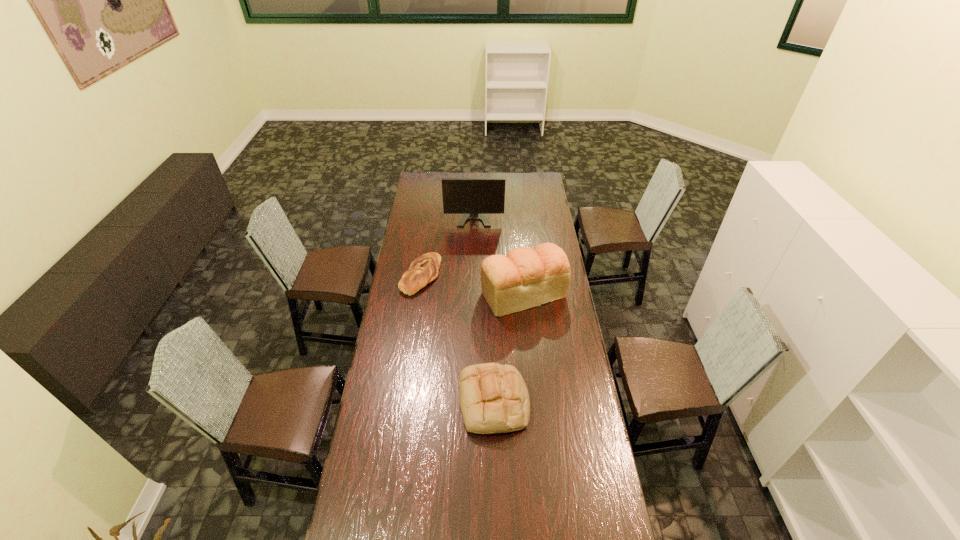
Locate an element on the screen. The image size is (960, 540). vacant space in between the third shortest object and the tallest bread is located at coordinates (509, 348).

This screenshot has width=960, height=540. I want to click on unoccupied area between the second nearest object and the leftmost bread, so click(x=457, y=339).

Identify the location of vacant space that is in between the tallest bread and the computer monitor. (499, 250).

The image size is (960, 540). I want to click on object that stands as the fourth closest to the shortest bread, so click(x=378, y=539).

At what (x,y) coordinates should I click in order to perform the action: click on object that ranks as the closest to the nearest object. Please return your answer as a coordinate pair (x, y). Looking at the image, I should click on (494, 398).

Choose which bread is the nearest neighbor to the shortest bread. Please provide its 2D coordinates. Your answer should be formatted as a tuple, i.e. [(x, y)], where the tuple contains the x and y coordinates of a point satisfying the conditions above.

[(524, 278)]

Identify which bread is located as the second nearest to the shortest bread. Please provide its 2D coordinates. Your answer should be formatted as a tuple, i.e. [(x, y)], where the tuple contains the x and y coordinates of a point satisfying the conditions above.

[(494, 398)]

You are a GUI agent. You are given a task and a screenshot of the screen. Output one action in this format:
    pyautogui.click(x=<x>, y=<y>)
    Task: Click on the blank space that satisfies the following two spatial constraints: 1. on the screen side of the computer monitor; 2. on the left side of the nearest bread
    The height and width of the screenshot is (540, 960).
    Given the screenshot: What is the action you would take?
    pyautogui.click(x=471, y=402)